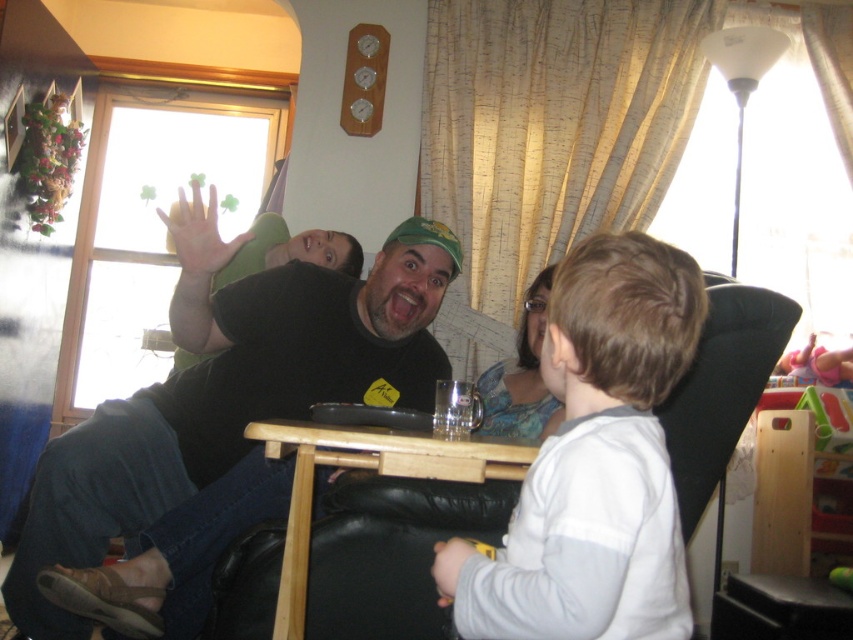
Question: Does blue floral dress at center appear under white matte hand at upper center?

Choices:
 (A) yes
 (B) no

Answer: (A)

Question: Does white fleece shirt at center have a larger size compared to blue floral dress at center?

Choices:
 (A) no
 (B) yes

Answer: (A)

Question: Which of these objects is positioned farthest from the smooth skin hand at lower center?

Choices:
 (A) white fleece shirt at center
 (B) matte black shirt at center
 (C) white matte hand at upper center
 (D) blue floral dress at center

Answer: (D)

Question: Which object is the closest to the blue floral dress at center?

Choices:
 (A) matte black shirt at center
 (B) white fleece shirt at center

Answer: (A)

Question: Which point appears farthest from the camera in this image?

Choices:
 (A) (500, 372)
 (B) (184, 264)
 (C) (636, 376)

Answer: (A)

Question: Observing the image, what is the correct spatial positioning of white fleece shirt at center in reference to smooth skin hand at lower center?

Choices:
 (A) above
 (B) below

Answer: (A)